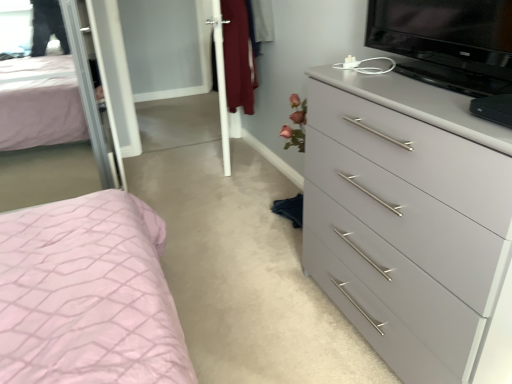
In order to face matte gray chest of drawers at right, should I rotate leftwards or rightwards?

To align with it, rotate right about 20.662°.

What is the approximate height of matte gray chest of drawers at right?

The height of matte gray chest of drawers at right is 37.65 inches.

The width and height of the screenshot is (512, 384). Describe the element at coordinates (411, 224) in the screenshot. I see `matte gray chest of drawers at right` at that location.

Where is `matte gray chest of drawers at right`? matte gray chest of drawers at right is located at coordinates (411, 224).

Where is `matte gray chest of drawers at right`? matte gray chest of drawers at right is located at coordinates (411, 224).